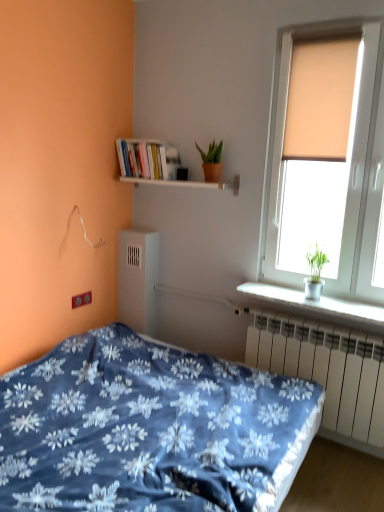
Where is `free point above beige fabric curtain at upper right (from a real-world perspective)`? free point above beige fabric curtain at upper right (from a real-world perspective) is located at coordinates (324, 23).